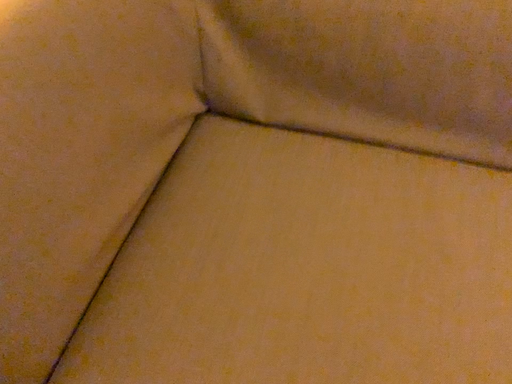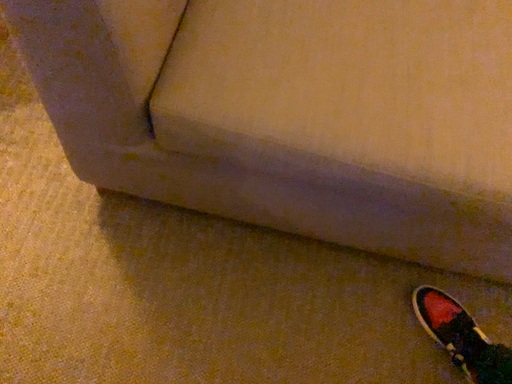
Question: Which way did the camera rotate in the video?

Choices:
 (A) rotated upward
 (B) rotated downward

Answer: (B)